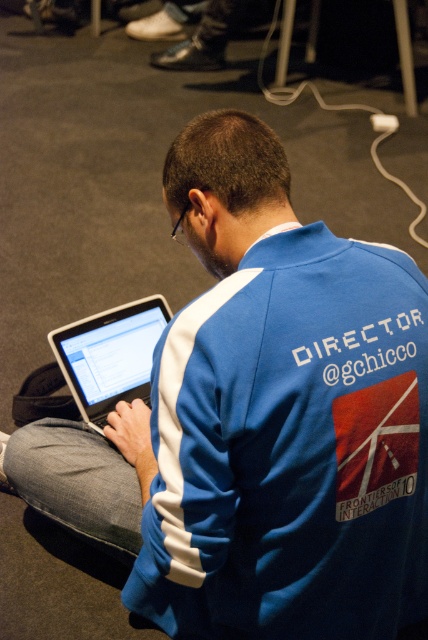
You are a photographer at an event and need to capture a closeup of the laptop screen without including the person. Given the gray fabric lap at lower left and the satin silver laptop at center, which object is wider so you can frame the shot to exclude the person?

The gray fabric lap at lower left is wider than the satin silver laptop at center, so framing the shot to exclude the person would require focusing on the laptop since it is narrower.

You are a photographer at the event. You want to take a photo of the person working on the laptop without any obstructions. Since the blue fabric sweatshirt at center is below the satin silver laptop at center, will the sweatshirt block the view of the laptop in the photo?

The blue fabric sweatshirt at center is located below the satin silver laptop at center, so it will block the view of the laptop in the photo.

You are a photographer at an event and need to capture a closeup shot of the blue fabric sweatshirt at center and the gray fabric lap at lower left. Your camera has a minimum focus distance of 16 inches. Can you focus on both subjects without moving the camera?

The distance between the blue fabric sweatshirt at center and the gray fabric lap at lower left is 16.70 inches. Since the minimum focus distance is 16 inches, the camera can focus on both subjects as the distance is within the required range.